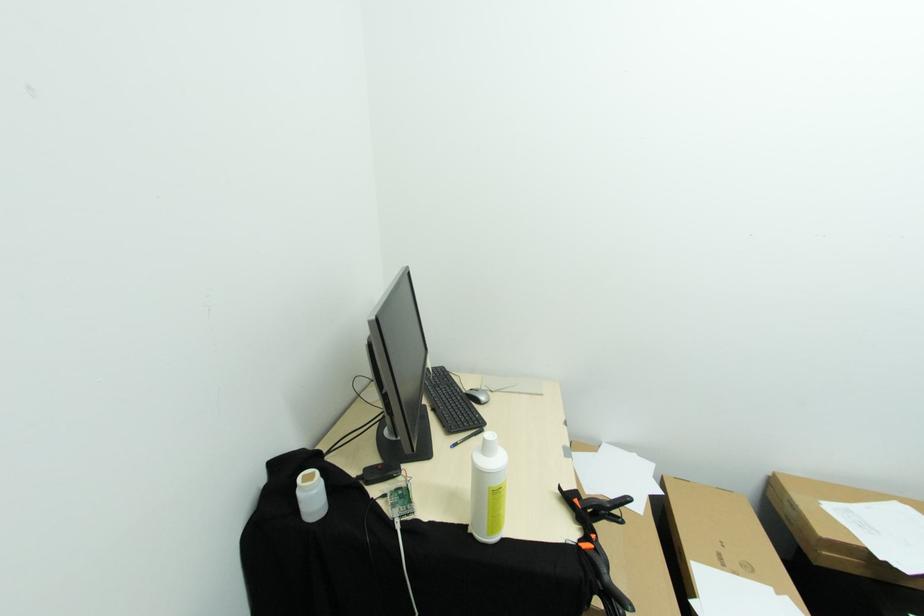
The width and height of the screenshot is (924, 616). Describe the element at coordinates (309, 482) in the screenshot. I see `a white bottle cap` at that location.